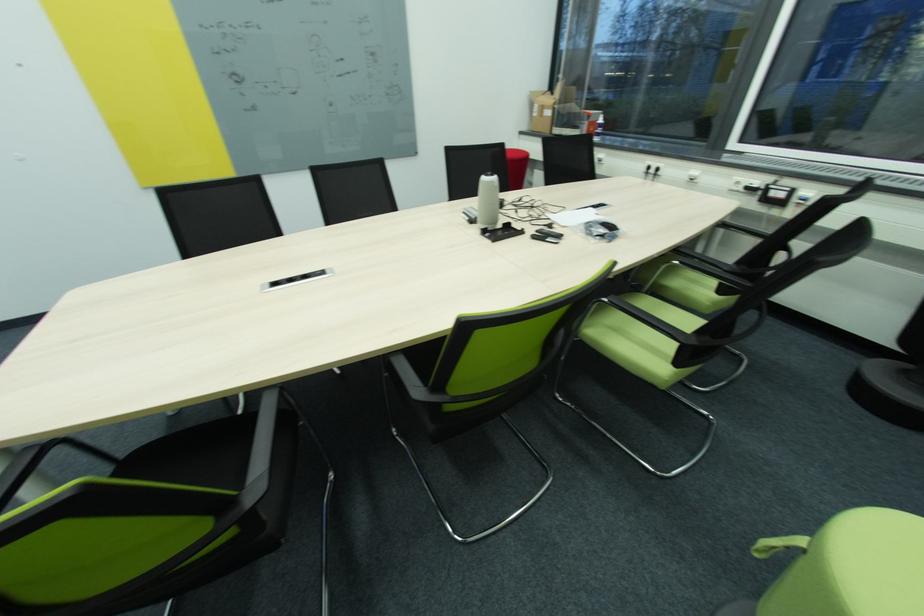
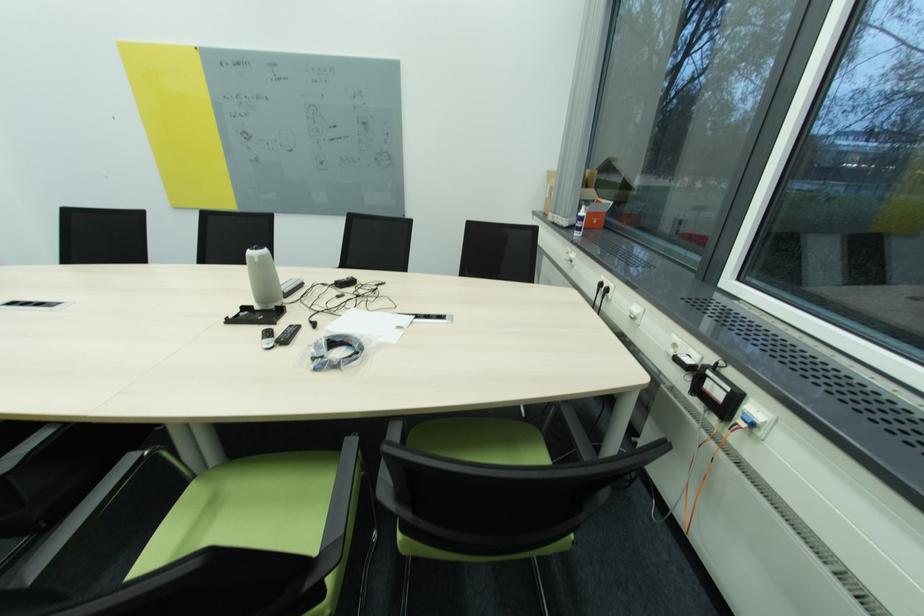
In the second image, find the point that corresponds to point (602, 134) in the first image.

(581, 228)